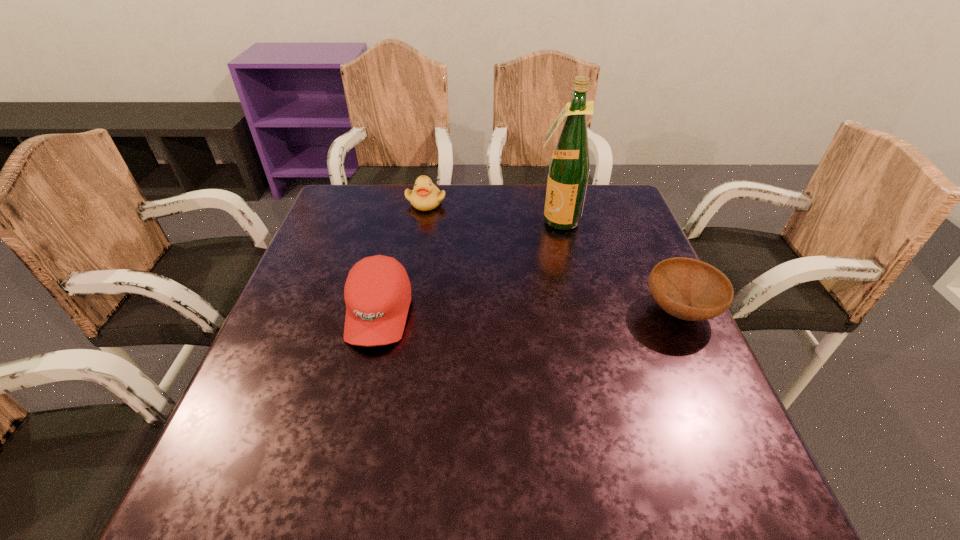
I want to click on vacant spot on the desktop that is between the cap and the bowl and is positioned on the front-facing side of the second object from right to left, so click(x=490, y=313).

Find the location of a particular element. This screenshot has width=960, height=540. free space on the desktop that is between the cap and the rightmost object and is positioned on the beak of the duckling is located at coordinates (502, 313).